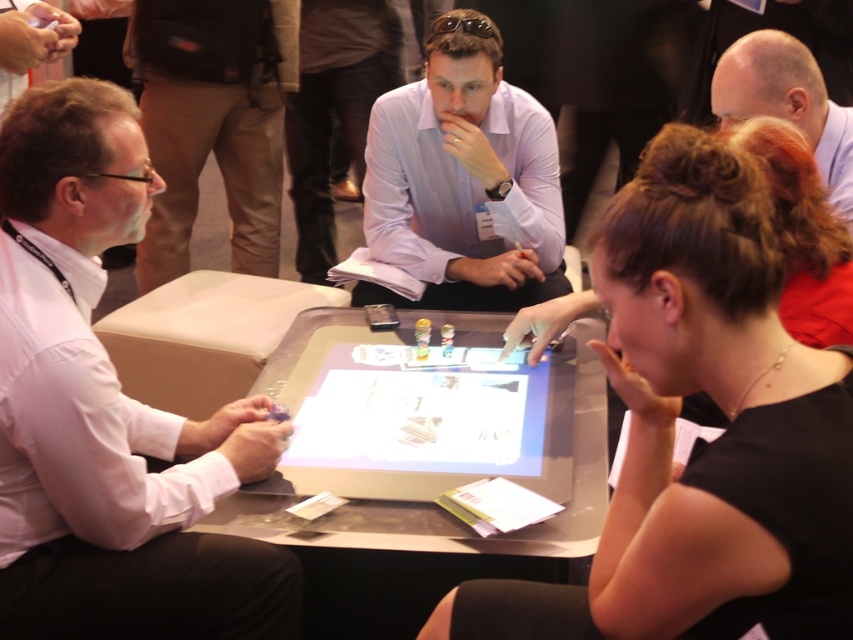
Who is more forward, [38,340] or [283,353]?

Positioned in front is point [38,340].

Identify the location of white glossy shirt at left. (108, 413).

Who is more forward, (553, 385) or (730, 74)?

Point (730, 74) is in front.

Describe the element at coordinates (461, 483) in the screenshot. The height and width of the screenshot is (640, 853). I see `transparent glass table at center` at that location.

Find the location of a particular element. Image resolution: width=853 pixels, height=640 pixels. transparent glass table at center is located at coordinates (461, 483).

Is the position of black matte hair at center less distant than that of light purple shirt at center?

Yes, it is.

Who is lower down, black matte hair at center or light purple shirt at center?

Positioned lower is black matte hair at center.

This screenshot has width=853, height=640. What are the coordinates of `black matte hair at center` in the screenshot? It's located at 689,384.

You are a GUI agent. You are given a task and a screenshot of the screen. Output one action in this format:
    pyautogui.click(x=<x>, y=<y>)
    Task: Click on the black matte hair at center
    
    Given the screenshot: What is the action you would take?
    pyautogui.click(x=689, y=384)